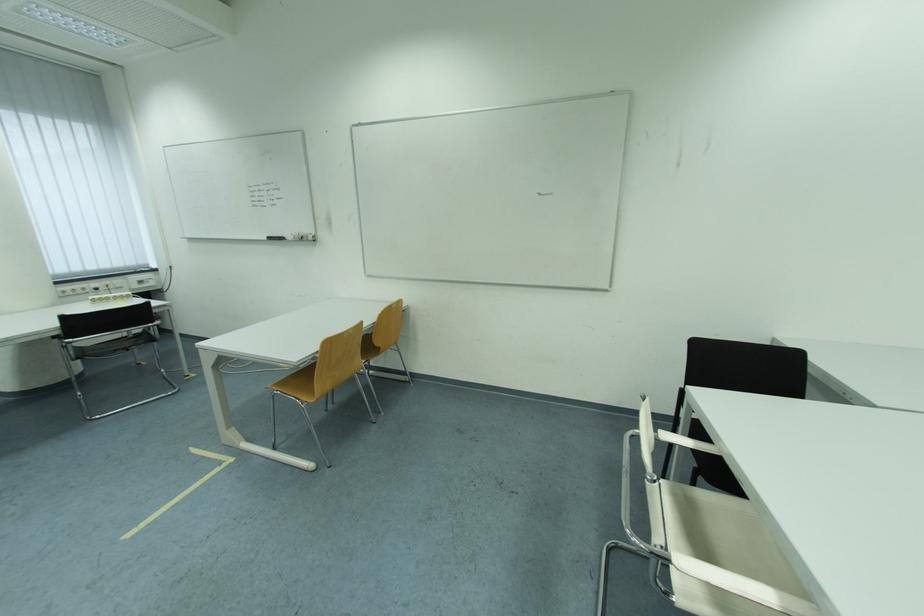
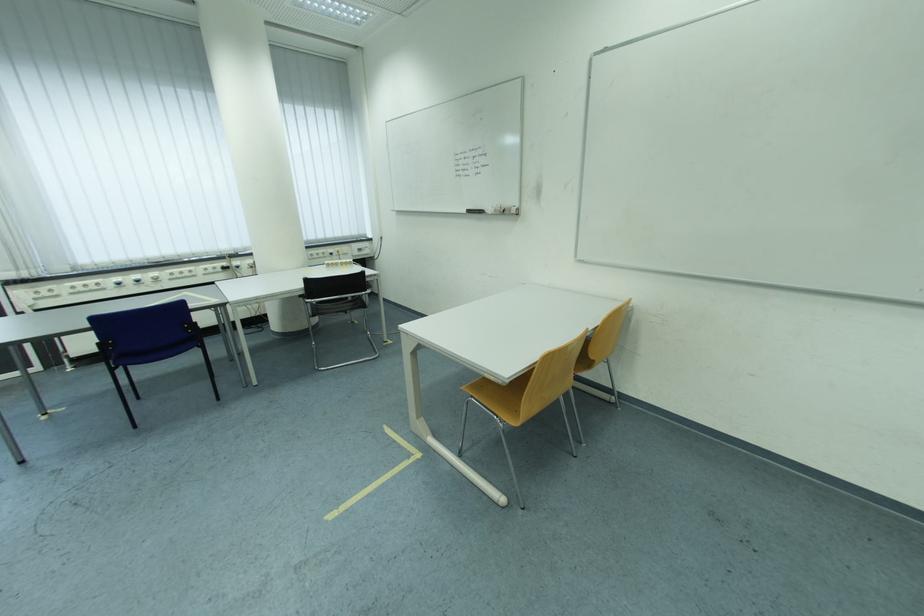
In the second image, find the point that corresponds to pixel 286 392 in the first image.

(481, 398)